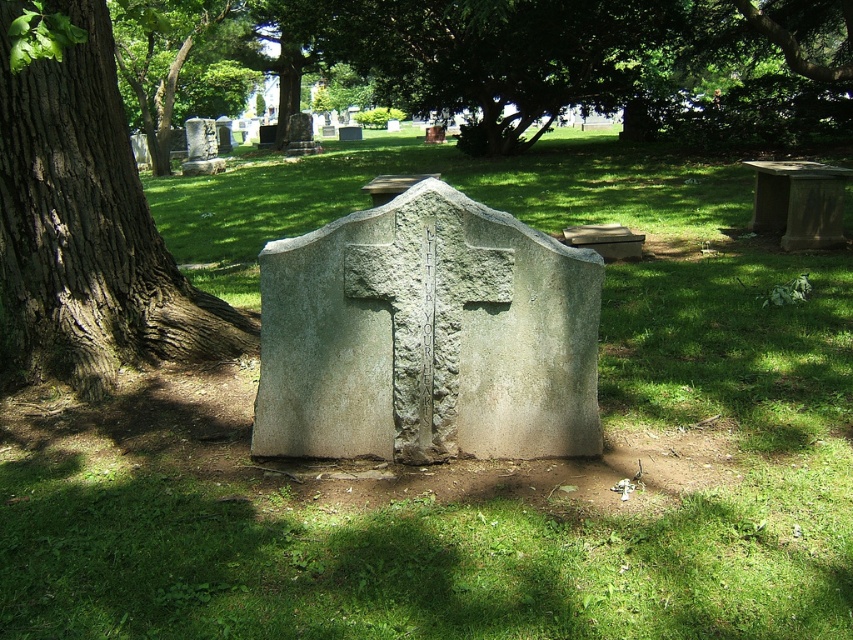
You are standing in the cemetery and want to touch both the gray stone cross at center and the dark brown bark tree at left. Which object should you approach first to reach the closer one?

The gray stone cross at center is closer to the viewer than the dark brown bark tree at left, so you should approach the gray stone cross at center first to reach the closer one.

You are standing in the cemetery and want to take a photo of the gray stone cross at center and the dark brown bark tree at left. Which object will appear taller in the photo?

The dark brown bark tree at left will appear taller in the photo because the gray stone cross at center has a lesser height compared to dark brown bark tree at left.

From the picture: You are standing in the cemetery and want to take a photo of both the gray stone cross at center and the green leafy tree at upper left. Which object will appear larger in the photo?

The gray stone cross at center will appear larger in the photo because it is closer to the viewer than the green leafy tree at upper left.